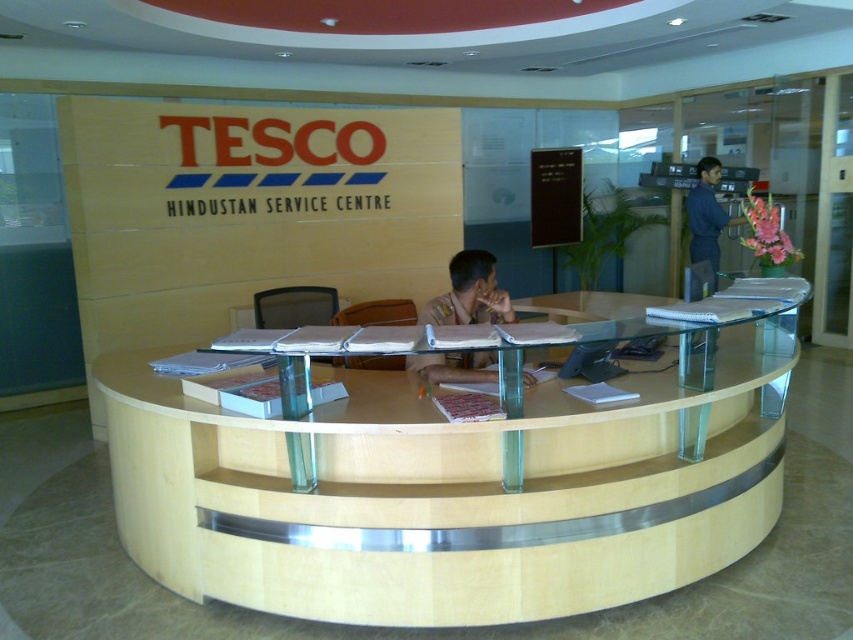
Who is higher up, light wood/woodenobject at center or brown uniform at center?

brown uniform at center is above.

Can you confirm if light wood/woodenobject at center is positioned below brown uniform at center?

Correct, light wood/woodenobject at center is located below brown uniform at center.

The width and height of the screenshot is (853, 640). Find the location of `light wood/woodenobject at center`. light wood/woodenobject at center is located at coordinates (448, 492).

Is brown uniform at center positioned behind blue uniform shirt at right?

No, it is not.

Is brown uniform at center below blue uniform shirt at right?

Yes.

Image resolution: width=853 pixels, height=640 pixels. In order to click on brown uniform at center in this screenshot , I will do `click(469, 292)`.

Where is `brown uniform at center`? This screenshot has width=853, height=640. brown uniform at center is located at coordinates (469, 292).

Between point (541, 548) and point (706, 196), which one is positioned in front?

Point (541, 548) is more forward.

Does light wood/woodenobject at center appear under blue uniform shirt at right?

Correct, light wood/woodenobject at center is located below blue uniform shirt at right.

Image resolution: width=853 pixels, height=640 pixels. What do you see at coordinates (448, 492) in the screenshot? I see `light wood/woodenobject at center` at bounding box center [448, 492].

Find the location of a particular element. The width and height of the screenshot is (853, 640). light wood/woodenobject at center is located at coordinates (448, 492).